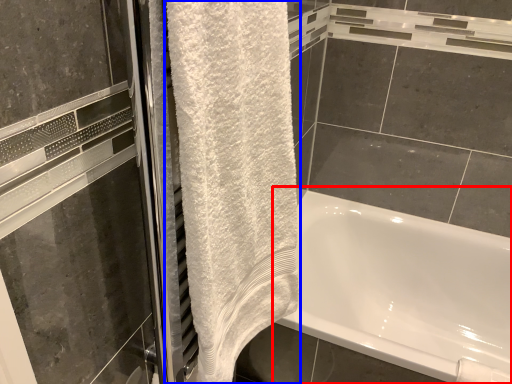
Question: Which object appears closest to the camera in this image, bathtub (highlighted by a red box) or towel (highlighted by a blue box)?

Choices:
 (A) bathtub
 (B) towel

Answer: (B)